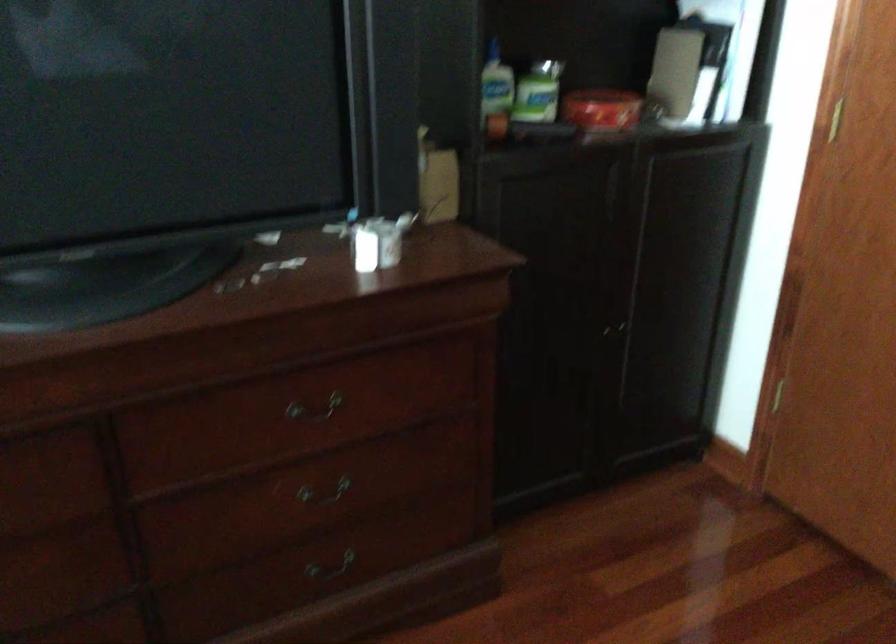
The image size is (896, 644). Identify the location of green lidded jar. (538, 91).